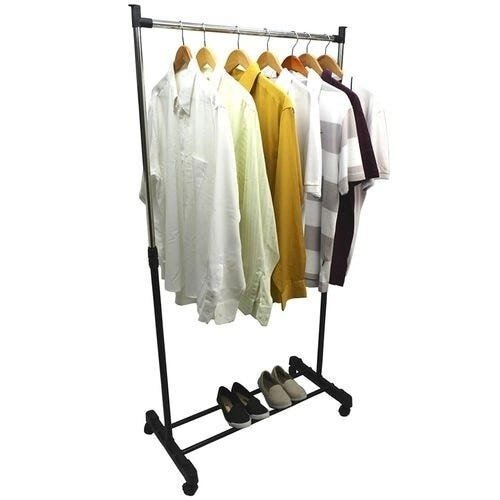
The width and height of the screenshot is (500, 500). I want to click on wooden hangers, so click(x=182, y=53), click(x=204, y=54), click(x=238, y=57), click(x=267, y=58), click(x=293, y=61), click(x=306, y=58), click(x=329, y=61).